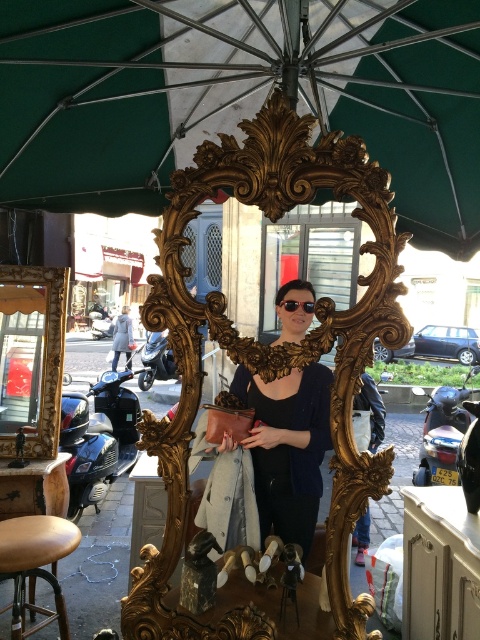
You are a delivery person who needs to carry both the gold ornate mirror at center and the sunglasses at center in a box that can only hold items up to the width of the mirror. Can you fit both items without exceeding the box width limit?

The gold ornate mirror at center is wider than the sunglasses at center. Since the box can only hold items up to the mirror width, you can fit both items as the mirror is the wider one and the sunglasses are narrower, so their combined width would not exceed the limit.

You are a customer at the outdoor market under the large green umbrella. You want to find the gold ornate mirror at center. Based on the coordinates provided, where should you look relative to the other items in the scene?

The gold ornate mirror at center is located at coordinates point (267, 360), which places it near the center of the scene. Since the woman is standing behind it, you should look towards the central area where the woman is positioned, between the parked scooters and the buildings in the background.